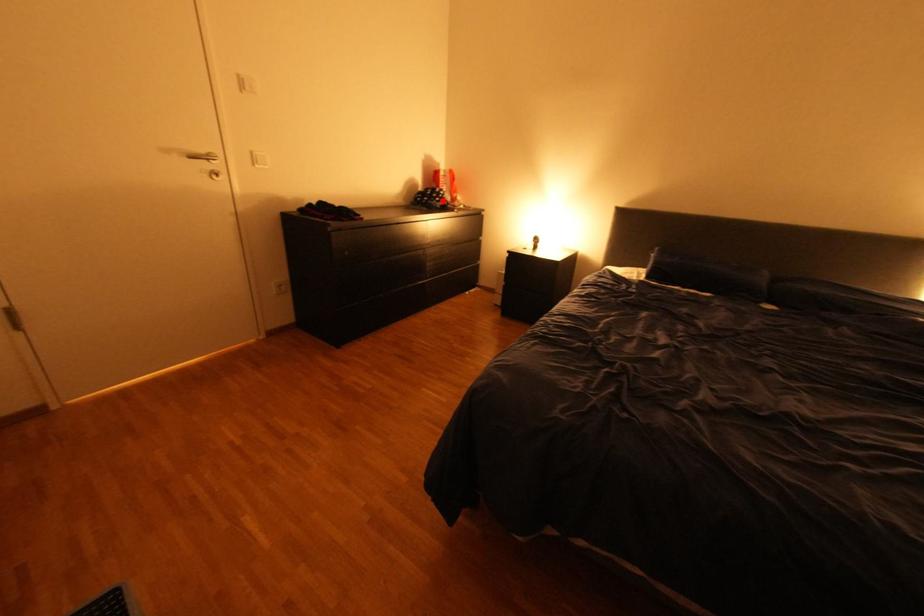
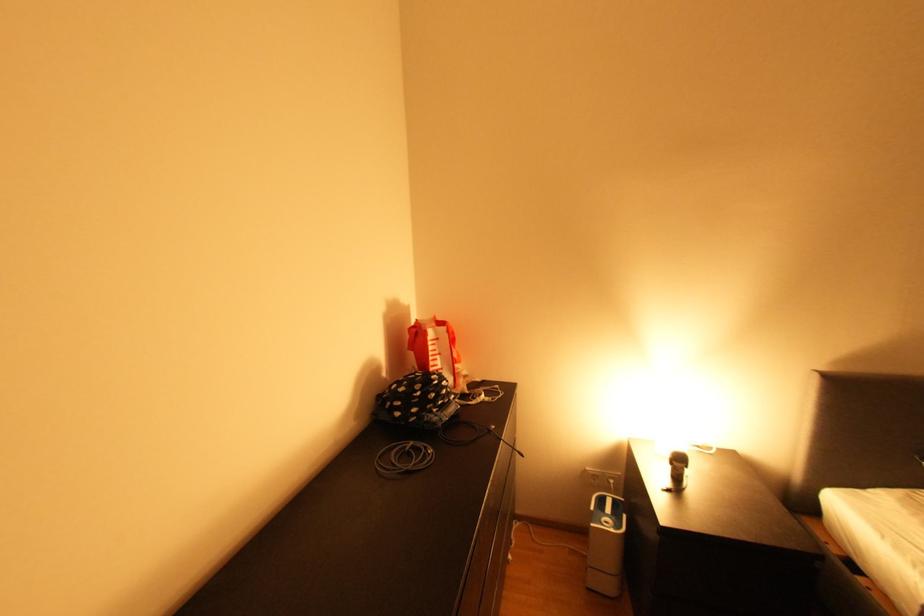
Locate, in the second image, the point that corresponds to the highlighted location in the first image.

(441, 411)